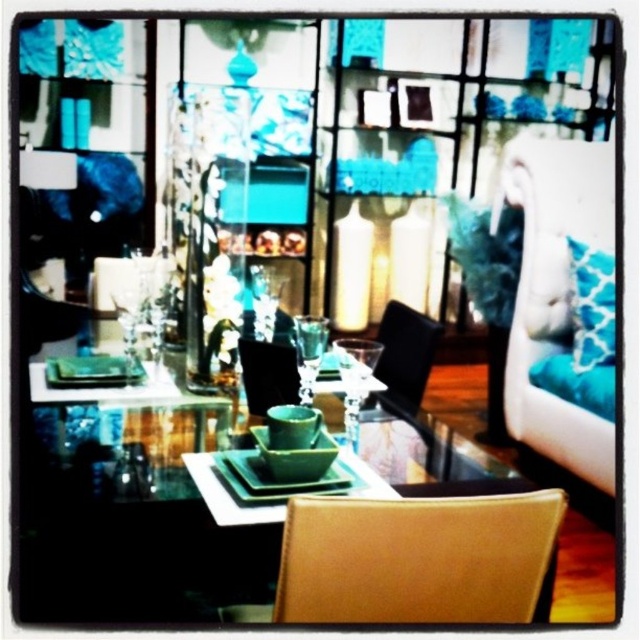
Question: Can you confirm if green glossy square plate at center is wider than teal fabric pillow at right?

Choices:
 (A) yes
 (B) no

Answer: (A)

Question: Can you confirm if green glossy square plate at center is positioned below leather chair at lower right?

Choices:
 (A) no
 (B) yes

Answer: (A)

Question: Is green glossy square plate at center above matte black chair at center?

Choices:
 (A) no
 (B) yes

Answer: (A)

Question: Based on their relative distances, which object is nearer to the green glossy square plate at center?

Choices:
 (A) teal fabric pillow at right
 (B) black leather chair at center

Answer: (B)

Question: Estimate the real-world distances between objects in this image. Which object is closer to the leather chair at lower right?

Choices:
 (A) teal fabric pillow at right
 (B) green glossy square plate at center
 (C) matte black chair at center

Answer: (B)

Question: Which point is closer to the camera?

Choices:
 (A) (579, 340)
 (B) (388, 380)
 (C) (44, 468)

Answer: (C)